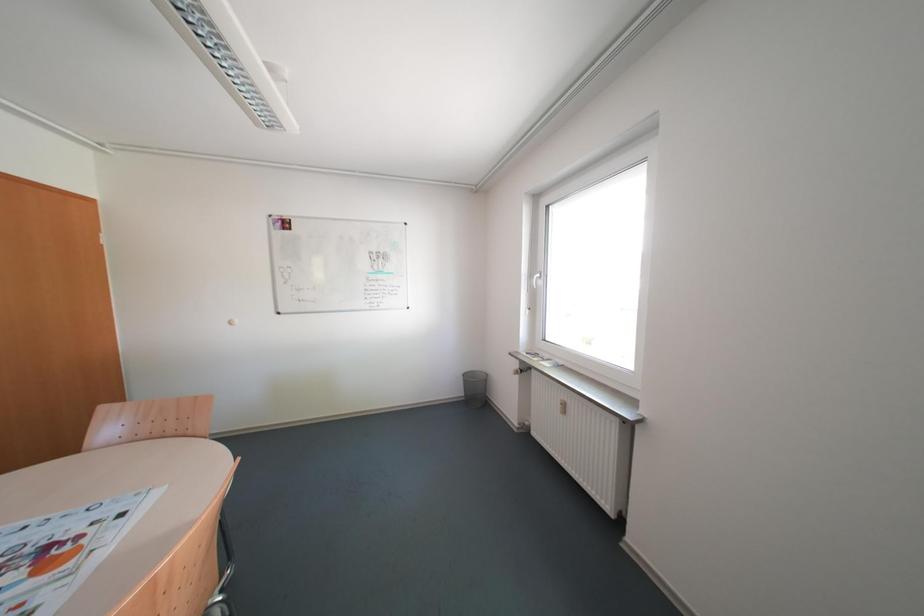
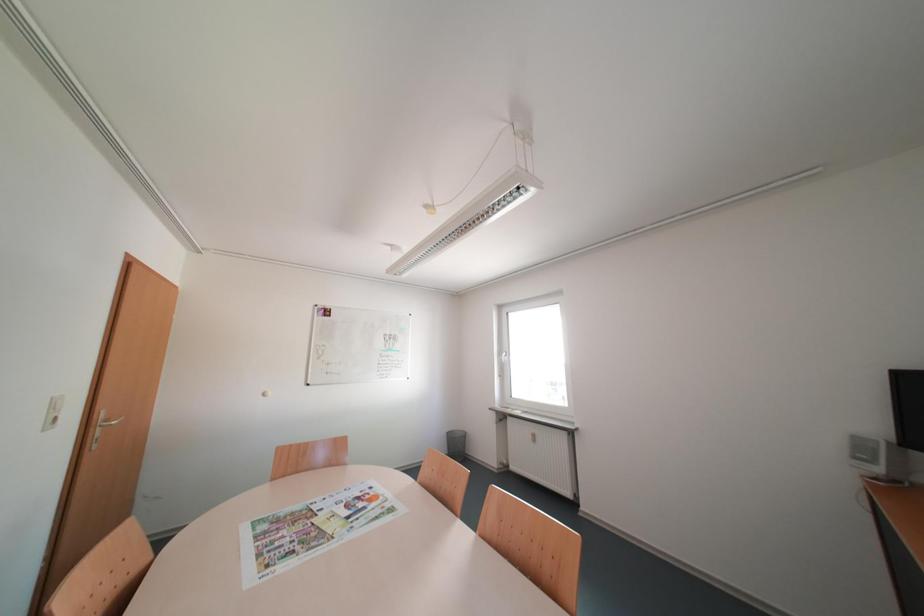
What movement of the cameraman would produce the second image?

The movement direction of the cameraman is left, backward.